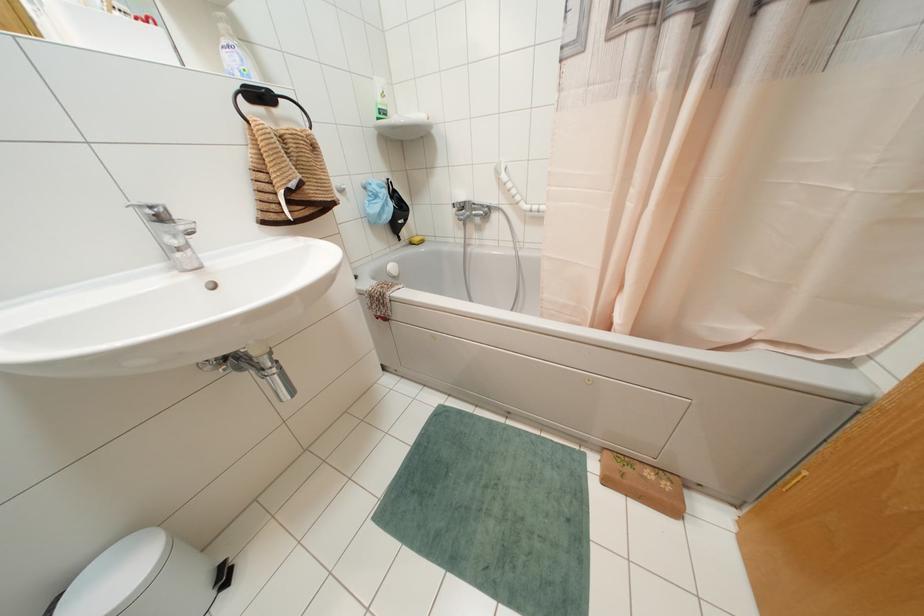
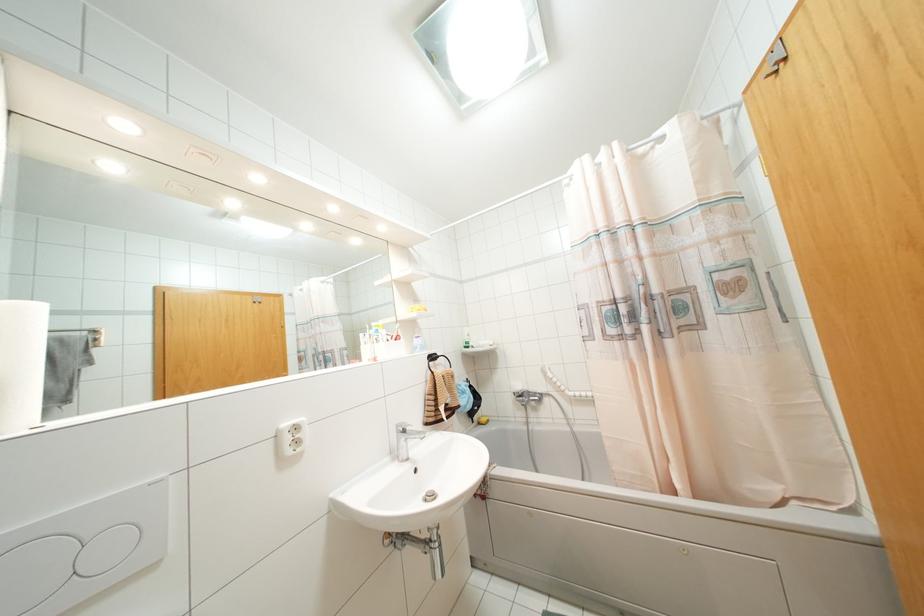
Where in the second image is the point corresponding to the point at 409,243 from the first image?

(479, 423)